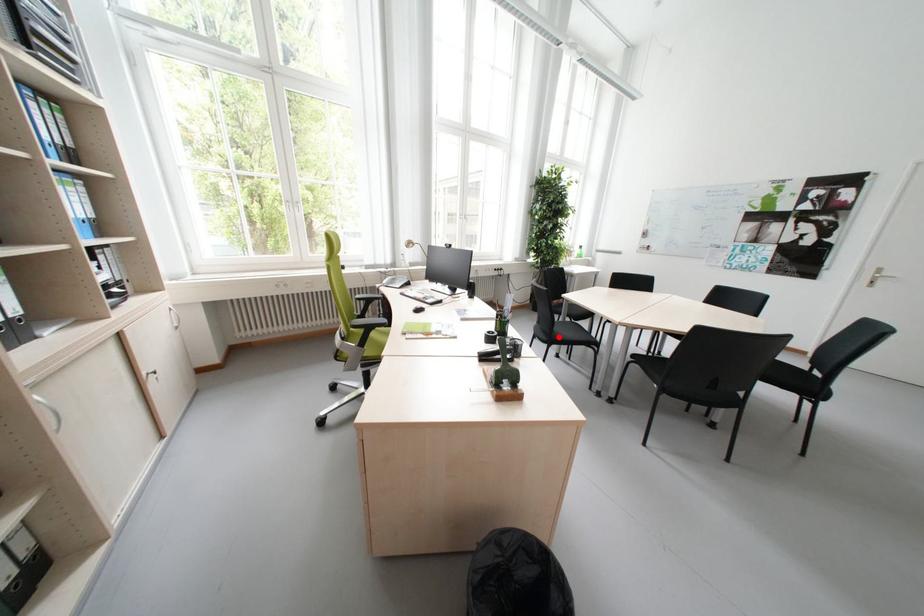
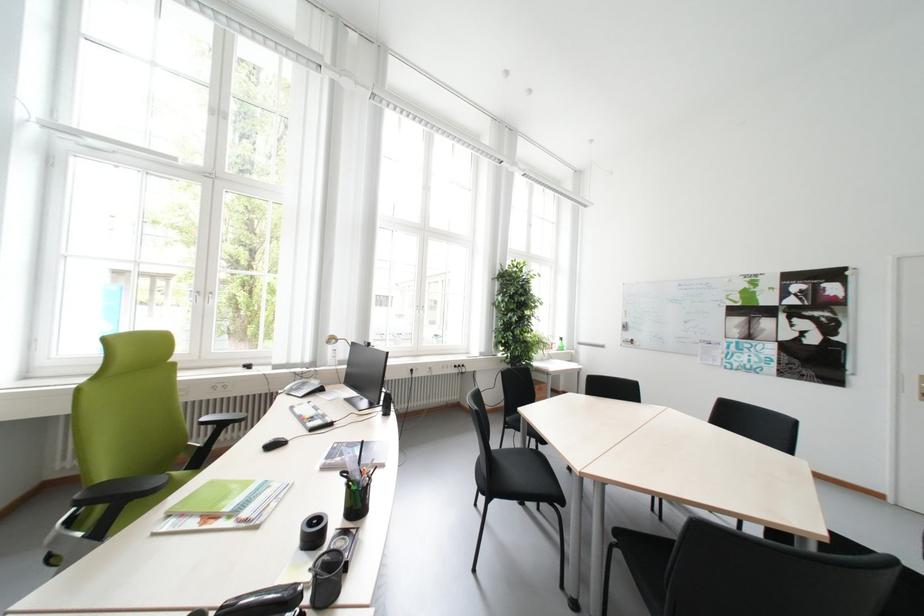
Where in the second image is the point corresponding to the highlighted location from the first image?

(502, 480)